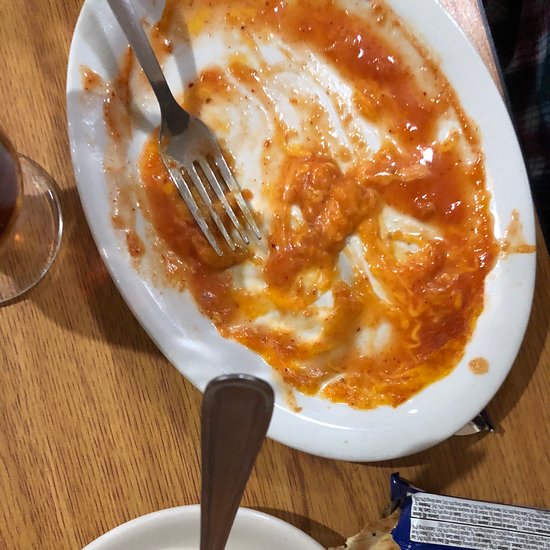
Where is `sauce on plate`? The width and height of the screenshot is (550, 550). sauce on plate is located at coordinates (359, 51).